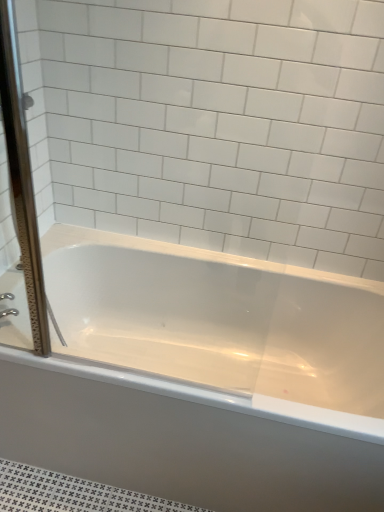
Question: Is silver metallic faucet at left facing away from clear glass screen door at left?

Choices:
 (A) yes
 (B) no

Answer: (B)

Question: Is the position of silver metallic faucet at left more distant than that of clear glass screen door at left?

Choices:
 (A) no
 (B) yes

Answer: (B)

Question: Is silver metallic faucet at left next to clear glass screen door at left and touching it?

Choices:
 (A) no
 (B) yes

Answer: (A)

Question: Can we say silver metallic faucet at left lies outside clear glass screen door at left?

Choices:
 (A) yes
 (B) no

Answer: (A)

Question: From the image's perspective, is silver metallic faucet at left beneath clear glass screen door at left?

Choices:
 (A) no
 (B) yes

Answer: (B)

Question: Is point (13, 312) positioned closer to the camera than point (8, 9)?

Choices:
 (A) farther
 (B) closer

Answer: (A)

Question: From a real-world perspective, is silver metallic faucet at left above or below clear glass screen door at left?

Choices:
 (A) above
 (B) below

Answer: (B)

Question: Looking at their shapes, would you say silver metallic faucet at left is wider or thinner than clear glass screen door at left?

Choices:
 (A) thin
 (B) wide

Answer: (A)

Question: Is silver metallic faucet at left taller or shorter than clear glass screen door at left?

Choices:
 (A) tall
 (B) short

Answer: (B)

Question: Looking at the image, does white glossy bathtub at center seem bigger or smaller compared to clear glass screen door at left?

Choices:
 (A) big
 (B) small

Answer: (A)

Question: In terms of height, does white glossy bathtub at center look taller or shorter compared to clear glass screen door at left?

Choices:
 (A) short
 (B) tall

Answer: (A)

Question: Is white glossy bathtub at center wider or thinner than clear glass screen door at left?

Choices:
 (A) wide
 (B) thin

Answer: (A)

Question: From a real-world perspective, relative to clear glass screen door at left, is white glossy bathtub at center vertically above or below?

Choices:
 (A) above
 (B) below

Answer: (B)

Question: Considering the positions of clear glass screen door at left and silver metallic faucet at left in the image, is clear glass screen door at left taller or shorter than silver metallic faucet at left?

Choices:
 (A) short
 (B) tall

Answer: (B)

Question: Based on their sizes in the image, would you say clear glass screen door at left is bigger or smaller than silver metallic faucet at left?

Choices:
 (A) small
 (B) big

Answer: (B)